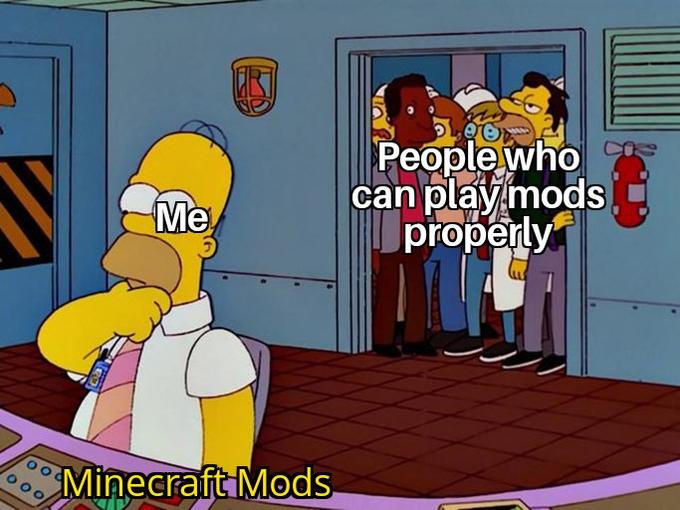
Where is `fire extinguisher`? The height and width of the screenshot is (510, 680). fire extinguisher is located at coordinates (643, 189).